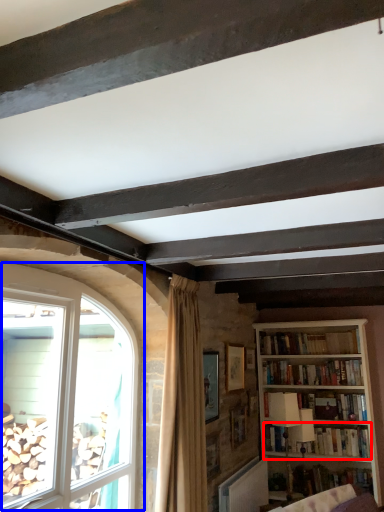
Question: Which object is further to the camera taking this photo, book (highlighted by a red box) or window (highlighted by a blue box)?

Choices:
 (A) book
 (B) window

Answer: (A)